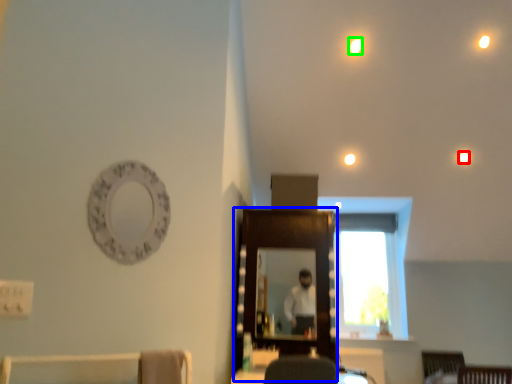
Question: Based on their relative distances, which object is nearer to lighting (highlighted by a red box)? Choose from mirror (highlighted by a blue box) and lighting (highlighted by a green box).

Choices:
 (A) mirror
 (B) lighting

Answer: (B)